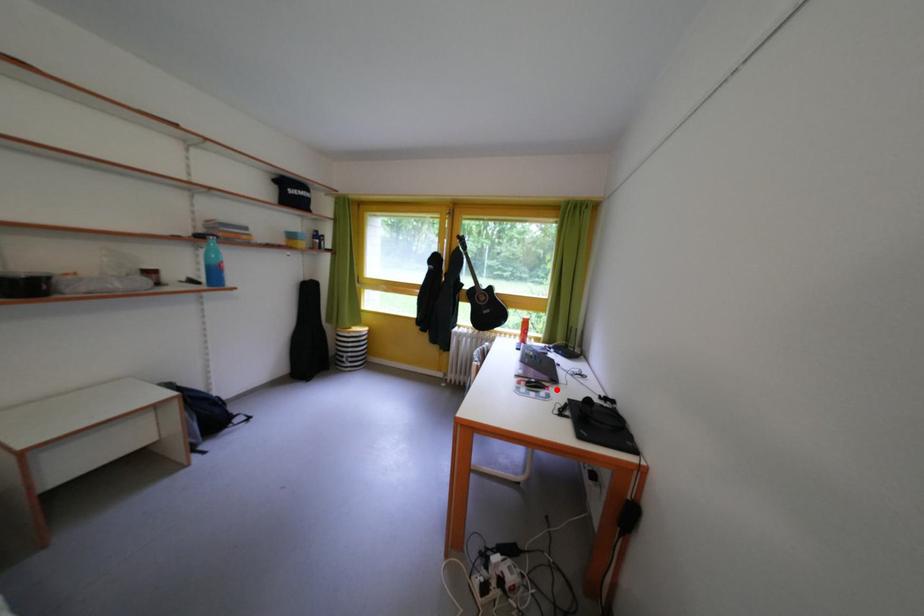
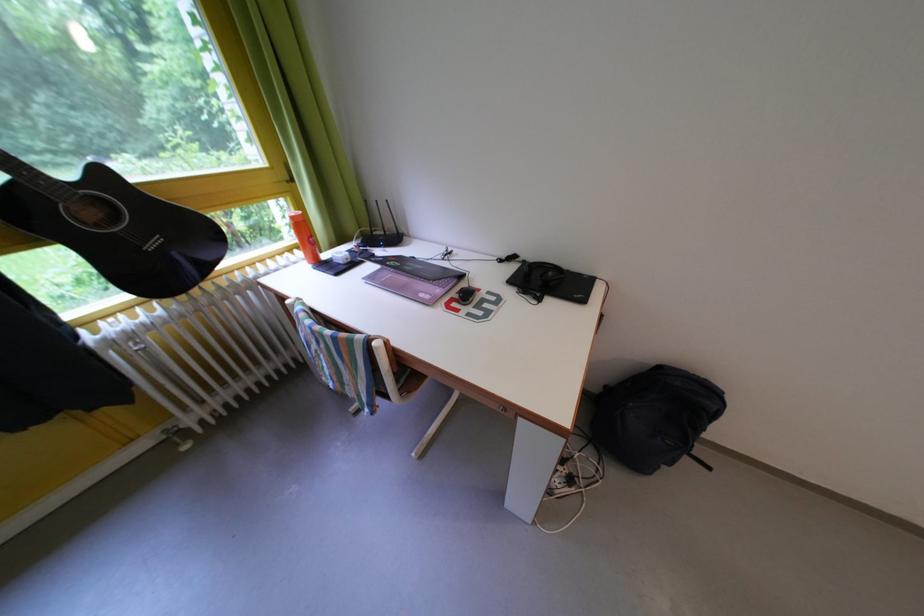
In the second image, find the point that corresponds to the highlighted location in the first image.

(473, 291)